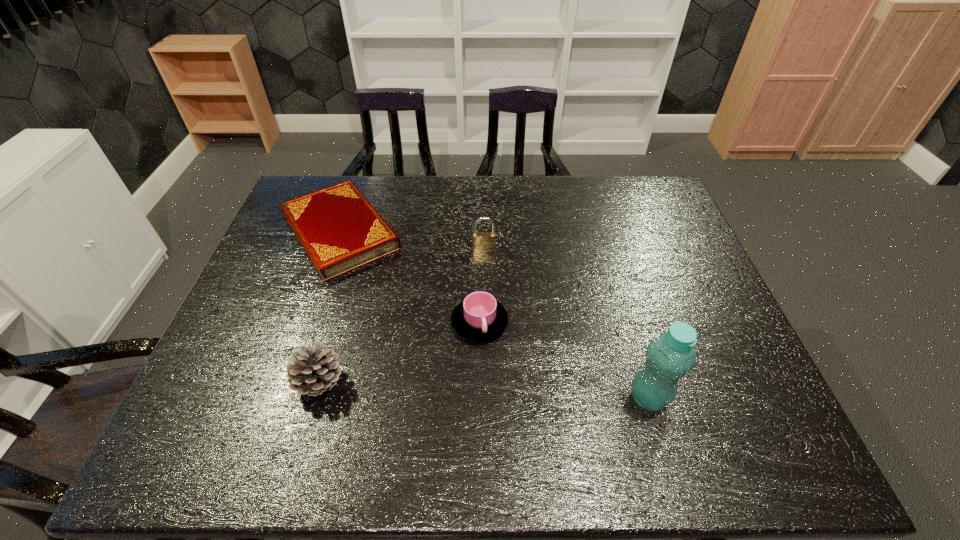
The image size is (960, 540). Find the location of `object that is at the left edge`. object that is at the left edge is located at coordinates (339, 230).

At what (x,y) coordinates should I click in order to perform the action: click on object located in the far left corner section of the desktop. Please return your answer as a coordinate pair (x, y). The image size is (960, 540). Looking at the image, I should click on (339, 230).

You are a GUI agent. You are given a task and a screenshot of the screen. Output one action in this format:
    pyautogui.click(x=<x>, y=<y>)
    Task: Click on the free space at the far edge of the desktop
    The image size is (960, 540).
    Given the screenshot: What is the action you would take?
    pyautogui.click(x=382, y=191)

This screenshot has width=960, height=540. What are the coordinates of `blank space at the near edge of the desktop` in the screenshot? It's located at point(679,412).

In the image, there is a desktop. In order to click on vacant space at the left edge in this screenshot , I will do `click(271, 306)`.

In the image, there is a desktop. Identify the location of blank space at the right edge. (673, 286).

Identify the location of free space at the far left corner of the desktop. (325, 177).

This screenshot has width=960, height=540. In order to click on free space between the padlock and the pinecone in this screenshot , I will do `click(402, 316)`.

Locate an element on the screen. This screenshot has height=540, width=960. vacant area between the padlock and the water bottle is located at coordinates (566, 323).

The image size is (960, 540). I want to click on unoccupied position between the pinecone and the padlock, so click(x=402, y=316).